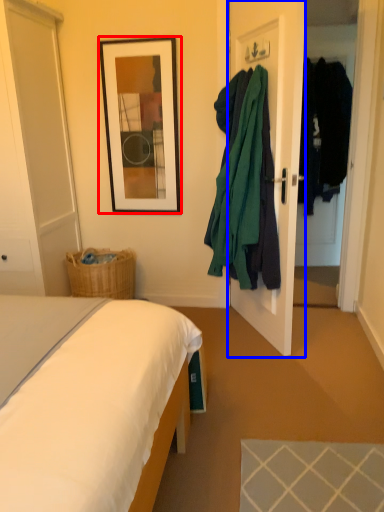
Question: Which object appears farthest to the camera in this image, picture frame (highlighted by a red box) or door (highlighted by a blue box)?

Choices:
 (A) picture frame
 (B) door

Answer: (A)